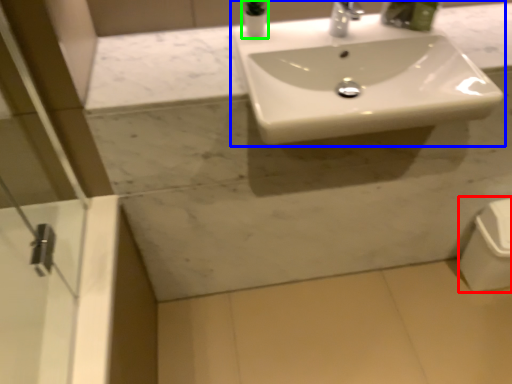
Question: Considering the real-world distances, which object is closest to porcelain (highlighted by a red box)? sink (highlighted by a blue box) or toiletry (highlighted by a green box).

Choices:
 (A) sink
 (B) toiletry

Answer: (A)